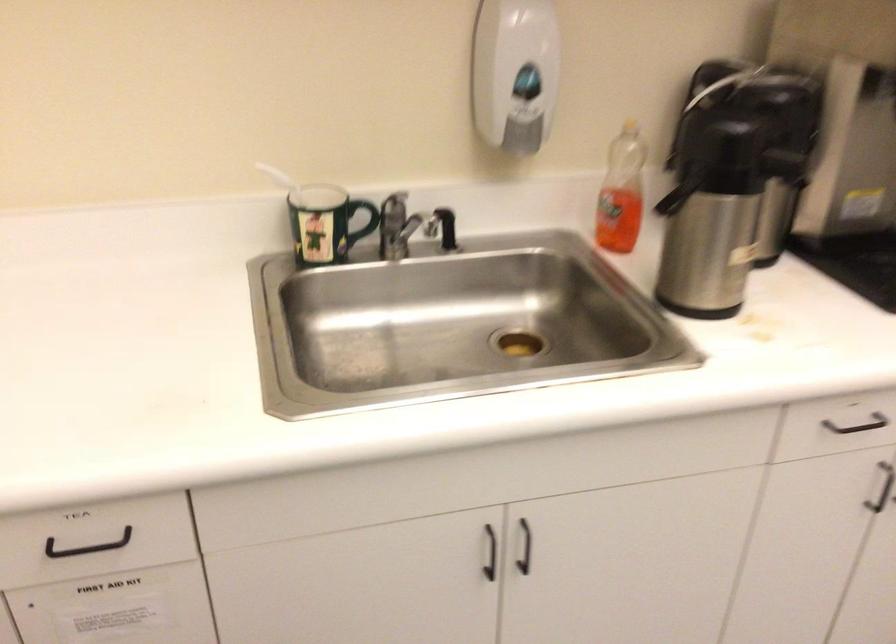
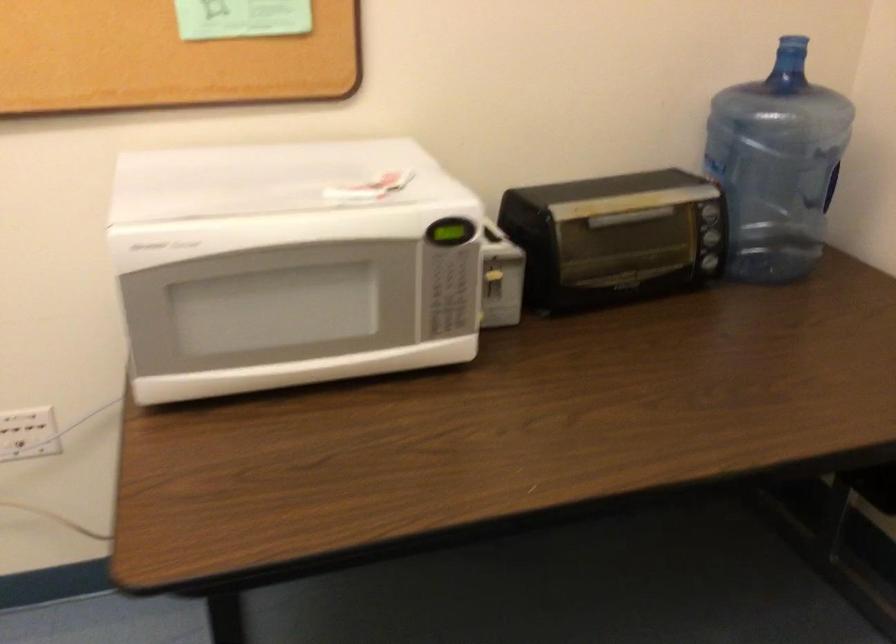
First-person continuous shooting, in which direction is the camera rotating?

The rotation direction of the camera is right-down.